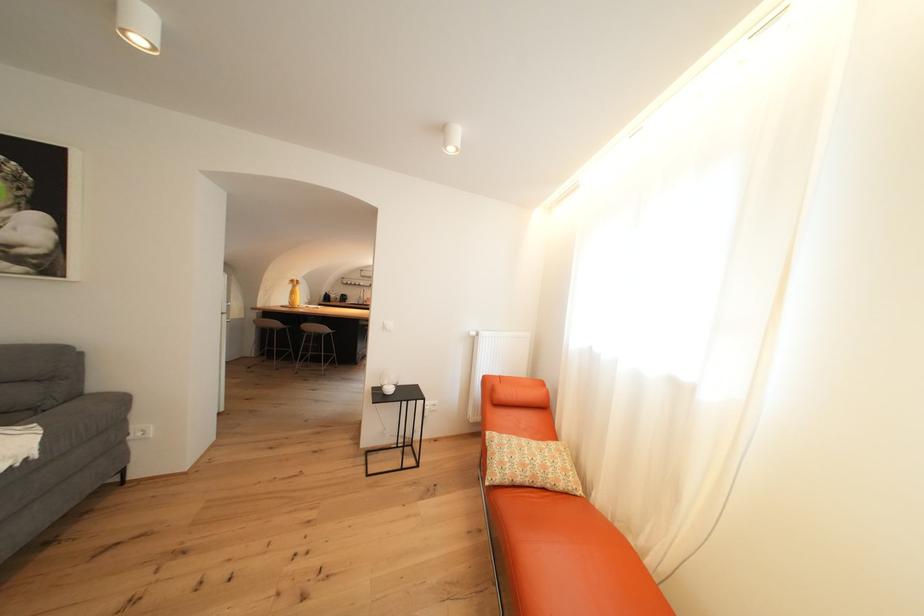
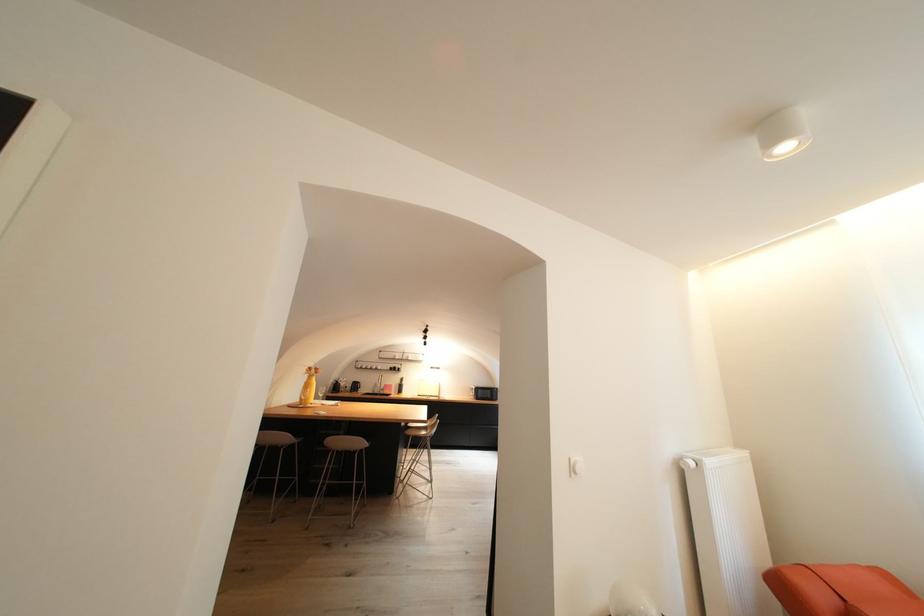
In a continuous first-person perspective shot, in which direction is the camera moving?

The cameraman moved toward left, forward.